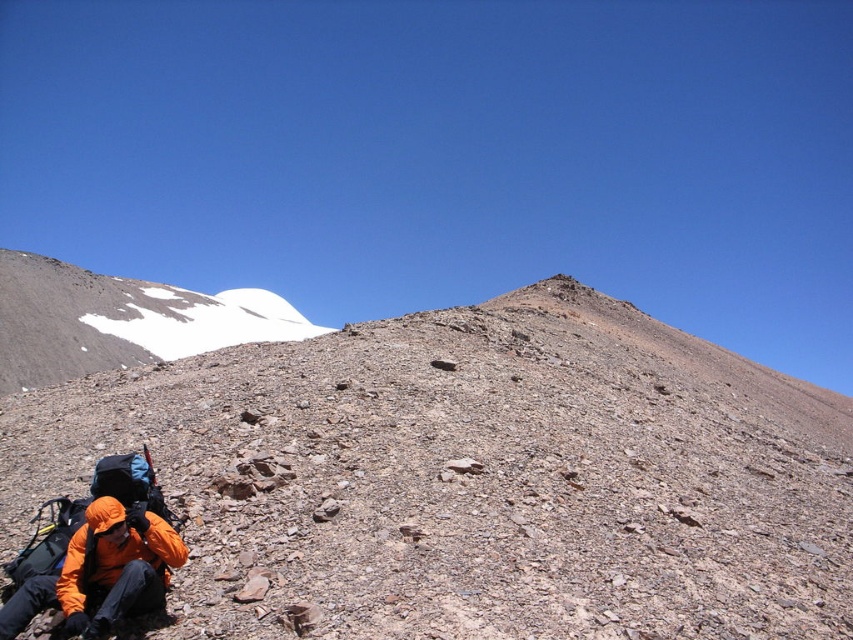
You are a hiker who has just reached a viewpoint. You see the brown rocky mountain at lower left and the orange fleece jacket at lower left. Which object is positioned to the right when looking from the viewpoint?

The brown rocky mountain at lower left is to the right of the orange fleece jacket at lower left.

You are a hiker who has just reached the summit and wants to take a photo of the brown rocky mountain at lower left. Where should you position yourself to capture it in the frame?

To capture the brown rocky mountain at lower left in your photo, position yourself so that the mountain is within the lower left portion of your camera frame, corresponding to the 2D coordinates approximately at point 0.748 on the x axis and 0.555 on the y axis.